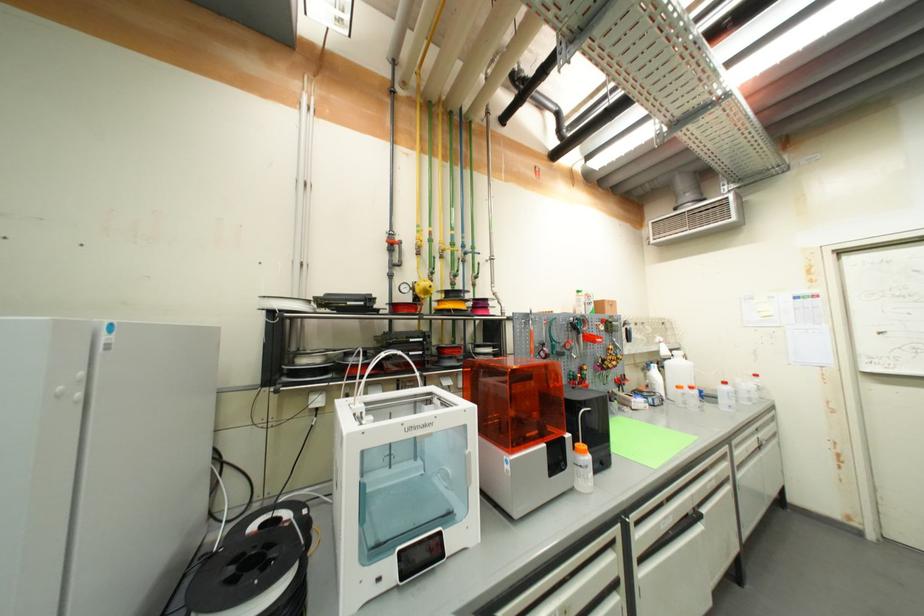
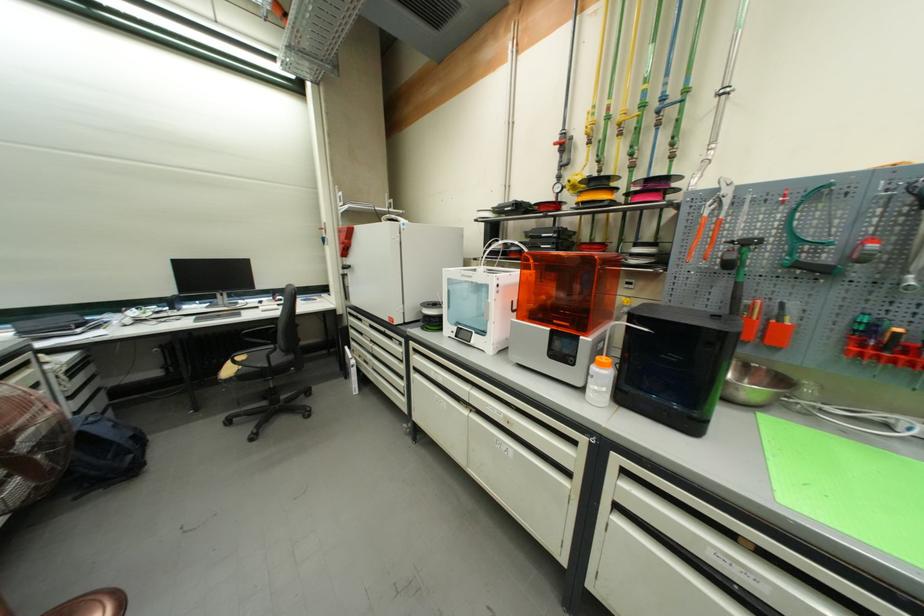
In the second image, find the point that corresponds to (594,411) in the first image.

(651, 331)